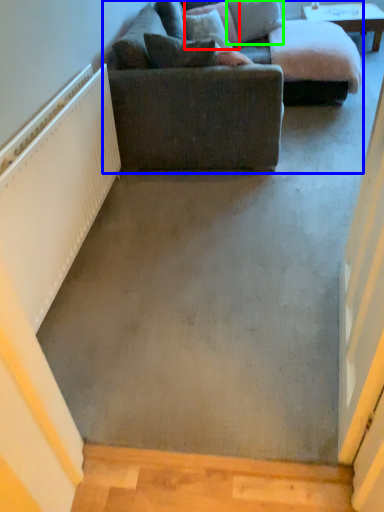
Question: Based on their relative distances, which object is nearer to pillow (highlighted by a red box)? Choose from studio couch (highlighted by a blue box) and pillow (highlighted by a green box).

Choices:
 (A) studio couch
 (B) pillow

Answer: (B)